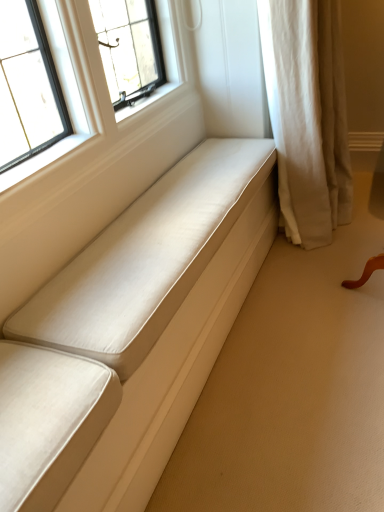
Describe the element at coordinates (307, 115) in the screenshot. I see `beige fabric curtain at right` at that location.

This screenshot has height=512, width=384. What are the coordinates of `beige fabric curtain at right` in the screenshot? It's located at tap(307, 115).

Image resolution: width=384 pixels, height=512 pixels. I want to click on matte white cushion at center, so (x=128, y=332).

Describe the element at coordinates (128, 332) in the screenshot. I see `matte white cushion at center` at that location.

At what (x,y) coordinates should I click in order to perform the action: click on beige fabric curtain at right. Please return your answer as a coordinate pair (x, y). The image size is (384, 512). Looking at the image, I should click on (307, 115).

Is beige fabric curtain at right at the left side of matte white cushion at center?

No.

Considering their positions, is beige fabric curtain at right located in front of or behind matte white cushion at center?

Visually, beige fabric curtain at right is located behind matte white cushion at center.

Which is behind, point (294, 101) or point (8, 333)?

The point (294, 101) is more distant.

From the image's perspective, is beige fabric curtain at right located beneath matte white cushion at center?

Actually, beige fabric curtain at right appears above matte white cushion at center in the image.

From a real-world perspective, is beige fabric curtain at right positioned above or below matte white cushion at center?

beige fabric curtain at right is above matte white cushion at center.

Based on the photo, in terms of width, does beige fabric curtain at right look wider or thinner when compared to matte white cushion at center?

Considering their sizes, beige fabric curtain at right looks broader than matte white cushion at center.

Who is taller, beige fabric curtain at right or matte white cushion at center?

Standing taller between the two is beige fabric curtain at right.

Is beige fabric curtain at right bigger than matte white cushion at center?

Yes.

Is matte white cushion at center surrounded by beige fabric curtain at right?

No, matte white cushion at center is located outside of beige fabric curtain at right.

Is beige fabric curtain at right beside matte white cushion at center?

No, beige fabric curtain at right is not touching matte white cushion at center.

Is beige fabric curtain at right turned away from matte white cushion at center?

No, beige fabric curtain at right's orientation is not away from matte white cushion at center.

In the scene shown: Measure the distance from beige fabric curtain at right to matte white cushion at center.

The distance of beige fabric curtain at right from matte white cushion at center is 27.37 inches.

The image size is (384, 512). I want to click on furniture below the beige fabric curtain at right (from the image's perspective), so click(128, 332).

Based on the photo, which object is positioned more to the right, matte white cushion at center or beige fabric curtain at right?

From the viewer's perspective, beige fabric curtain at right appears more on the right side.

Relative to beige fabric curtain at right, is matte white cushion at center in front or behind?

Clearly, matte white cushion at center is in front of beige fabric curtain at right.

Which is behind, point (91, 336) or point (298, 31)?

Point (298, 31)

From the image's perspective, is matte white cushion at center on top of beige fabric curtain at right?

Incorrect, from the image's perspective, matte white cushion at center is lower than beige fabric curtain at right.

From a real-world perspective, is matte white cushion at center physically below beige fabric curtain at right?

Correct, in the physical world, matte white cushion at center is lower than beige fabric curtain at right.

Does matte white cushion at center have a greater width compared to beige fabric curtain at right?

No.

Does matte white cushion at center have a greater height compared to beige fabric curtain at right?

Incorrect, the height of matte white cushion at center is not larger of that of beige fabric curtain at right.

Looking at this image, in terms of size, does matte white cushion at center appear bigger or smaller than beige fabric curtain at right?

Considering their sizes, matte white cushion at center takes up less space than beige fabric curtain at right.

Is matte white cushion at center located outside beige fabric curtain at right?

That's correct, matte white cushion at center is outside of beige fabric curtain at right.

Is matte white cushion at center beside beige fabric curtain at right?

No, matte white cushion at center is not with beige fabric curtain at right.

Is matte white cushion at center facing towards beige fabric curtain at right?

No, matte white cushion at center does not turn towards beige fabric curtain at right.

You are a GUI agent. You are given a task and a screenshot of the screen. Output one action in this format:
    pyautogui.click(x=<x>, y=<y>)
    Task: Click on the curtain behind the matte white cushion at center
    The height and width of the screenshot is (512, 384).
    Given the screenshot: What is the action you would take?
    pyautogui.click(x=307, y=115)

This screenshot has height=512, width=384. I want to click on curtain above the matte white cushion at center (from the image's perspective), so click(307, 115).

Identify the location of curtain located above the matte white cushion at center (from a real-world perspective). The image size is (384, 512). (307, 115).